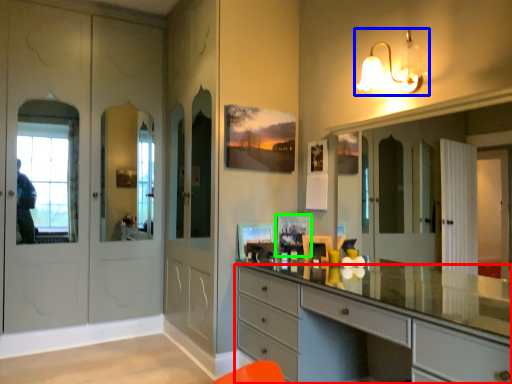
Question: Based on their relative distances, which object is nearer to chest of drawers (highlighted by a red box)? Choose from light fixture (highlighted by a blue box) and picture frame (highlighted by a green box).

Choices:
 (A) light fixture
 (B) picture frame

Answer: (B)